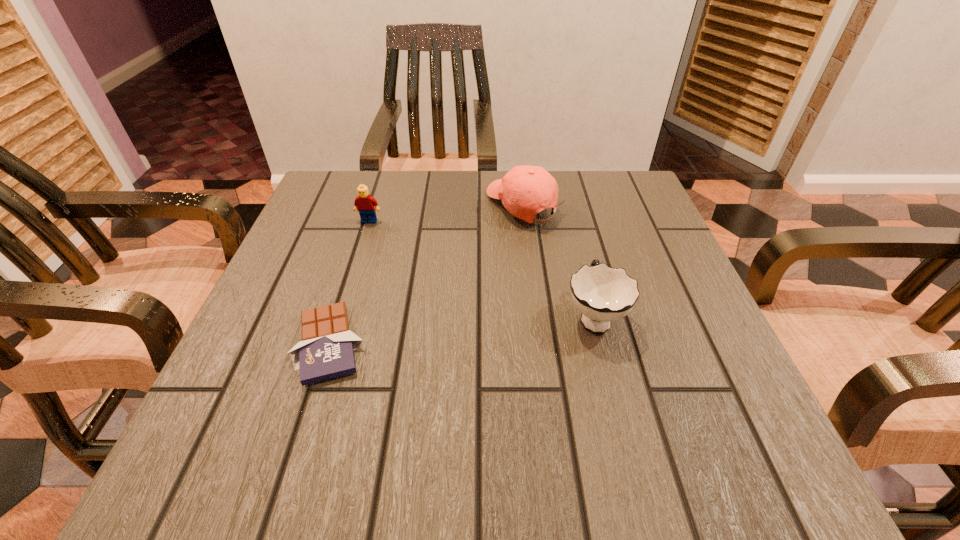
Locate an element on the screen. This screenshot has width=960, height=540. baseball cap that is at the far edge is located at coordinates (513, 189).

Locate an element on the screen. The width and height of the screenshot is (960, 540). Lego present at the far edge is located at coordinates (364, 203).

Where is `Lego that is at the left edge`? This screenshot has height=540, width=960. Lego that is at the left edge is located at coordinates (364, 203).

The width and height of the screenshot is (960, 540). Find the location of `chocolate bar that is positioned at the left edge`. chocolate bar that is positioned at the left edge is located at coordinates (326, 351).

Where is `object located at the right edge`? This screenshot has width=960, height=540. object located at the right edge is located at coordinates [x=602, y=294].

I want to click on object positioned at the far left corner, so tap(364, 203).

Find the location of `vacant space at the far edge`. vacant space at the far edge is located at coordinates (418, 170).

In the image, there is a desktop. Where is `vacant space at the left edge`? This screenshot has height=540, width=960. vacant space at the left edge is located at coordinates (348, 260).

The image size is (960, 540). What are the coordinates of `blank space at the right edge of the desktop` in the screenshot? It's located at (594, 250).

Identify the location of free space at the far left corner of the desktop. (348, 224).